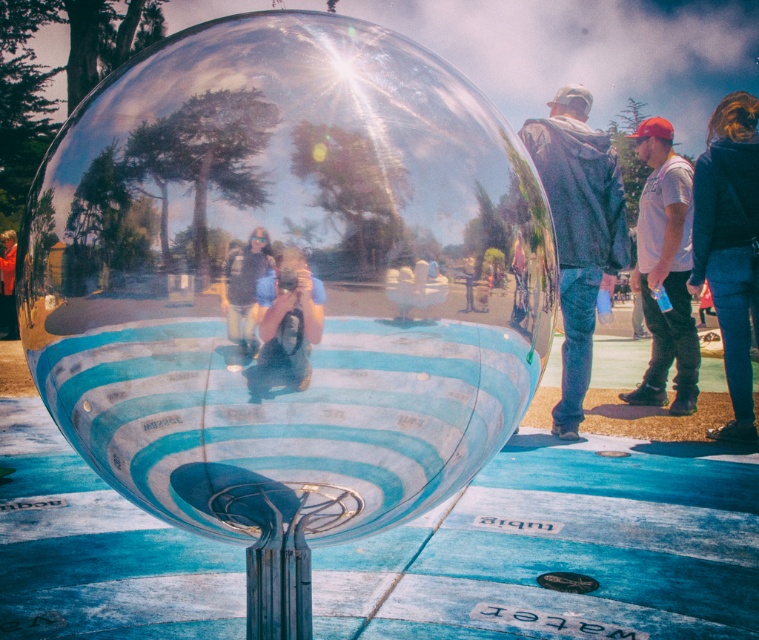
Question: Which of these objects is positioned farthest from the dark gray jacket at right?

Choices:
 (A) transparent glass bubble at center
 (B) white cotton shirt at right
 (C) orange fabric jacket at lower left
 (D) matte black camera at center

Answer: (C)

Question: Which of the following is the farthest from the observer?

Choices:
 (A) (729, 148)
 (B) (649, 140)
 (C) (291, 508)

Answer: (B)

Question: Can you confirm if transparent glass bubble at center is bigger than orange fabric jacket at lower left?

Choices:
 (A) yes
 (B) no

Answer: (B)

Question: Does dark blue jeans at lower right come behind white cotton shirt at right?

Choices:
 (A) yes
 (B) no

Answer: (B)

Question: Among these points, which one is farthest from the camera?

Choices:
 (A) (252, 300)
 (B) (304, 384)

Answer: (B)

Question: Can you confirm if transparent glass bubble at center is bigger than dark blue jeans at lower right?

Choices:
 (A) yes
 (B) no

Answer: (B)